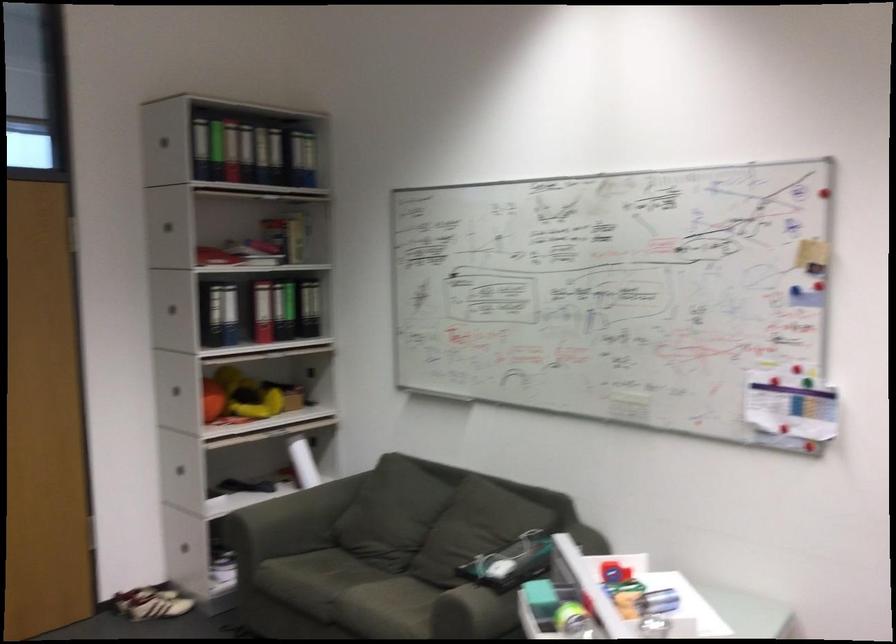
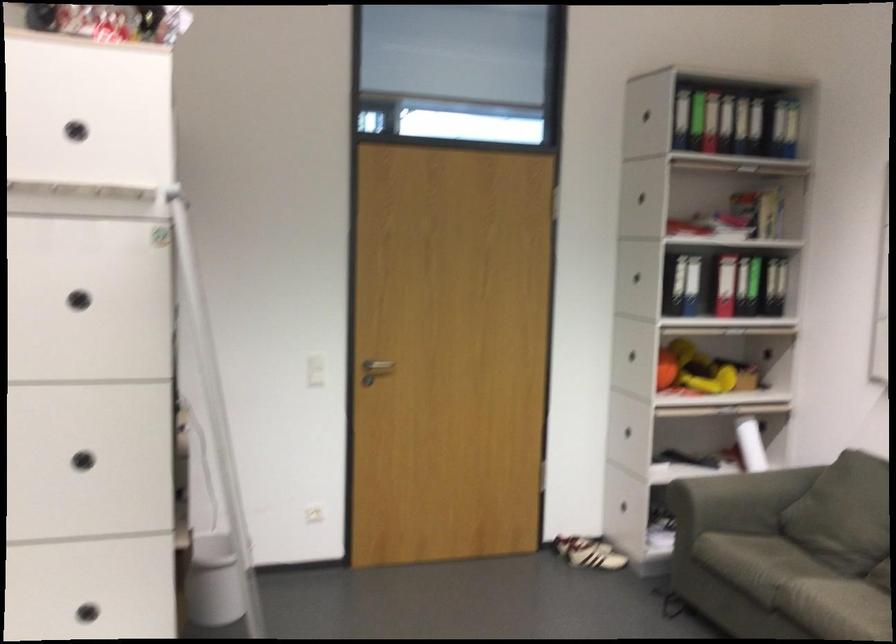
Where in the second image is the point corresponding to point 263,332 from the first image?

(725, 285)